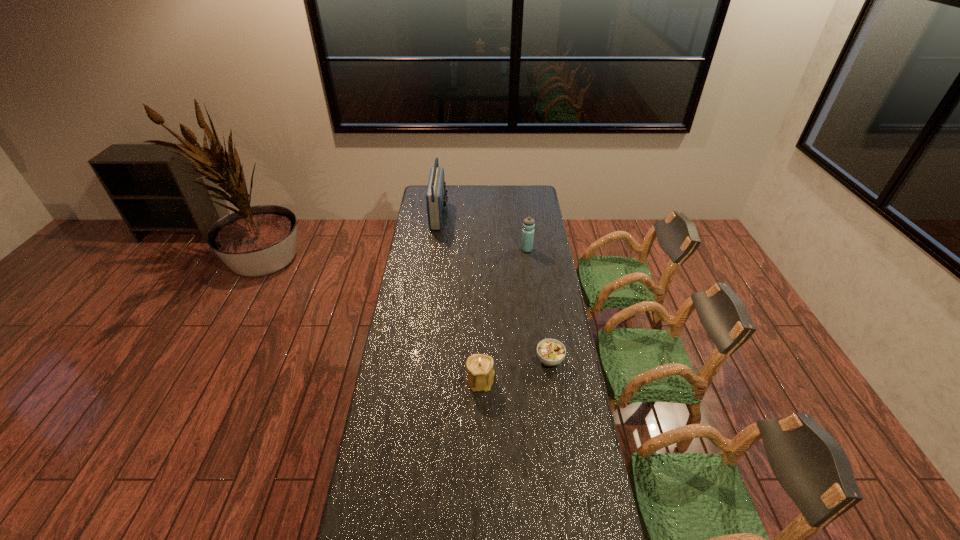
At what (x,y) coordinates should I click in order to perform the action: click on the tallest object. Please return your answer as a coordinate pair (x, y). This screenshot has width=960, height=540. Looking at the image, I should click on (436, 198).

Find the location of a particular element. the leftmost object is located at coordinates (436, 198).

The width and height of the screenshot is (960, 540). Find the location of `water bottle`. water bottle is located at coordinates (529, 223).

You are a GUI agent. You are given a task and a screenshot of the screen. Output one action in this format:
    pyautogui.click(x=<x>, y=<y>)
    Task: Click on the third shortest object
    The height and width of the screenshot is (540, 960).
    Given the screenshot: What is the action you would take?
    pyautogui.click(x=529, y=223)

The height and width of the screenshot is (540, 960). Find the location of `the third tallest object`. the third tallest object is located at coordinates (480, 375).

Where is `the third object from right to left`? The height and width of the screenshot is (540, 960). the third object from right to left is located at coordinates (480, 375).

Where is `the shortest object`? the shortest object is located at coordinates (551, 352).

Where is `blank space located 0.340m on the front panel of the radio receiver`? Image resolution: width=960 pixels, height=540 pixels. blank space located 0.340m on the front panel of the radio receiver is located at coordinates (504, 215).

Find the location of `free space located on the back of the third nearest object`. free space located on the back of the third nearest object is located at coordinates (522, 213).

Where is `vacant space situated on the front of the second shortest object`? The height and width of the screenshot is (540, 960). vacant space situated on the front of the second shortest object is located at coordinates (481, 421).